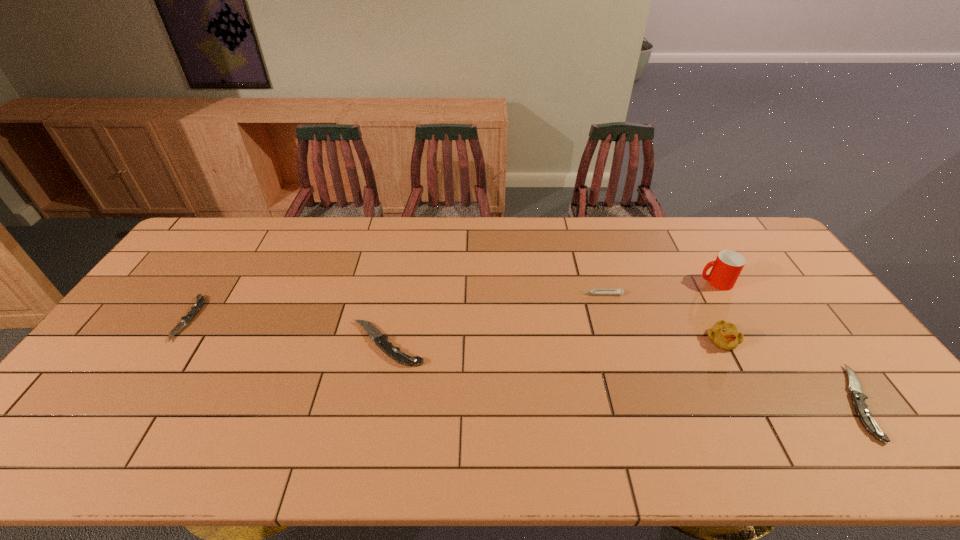
You are a GUI agent. You are given a task and a screenshot of the screen. Output one action in this format:
    pyautogui.click(x=<x>, y=<y>)
    Task: Click on the object at the left edge
    Image resolution: width=960 pixels, height=540 pixels.
    Given the screenshot: What is the action you would take?
    pyautogui.click(x=199, y=303)

Identify the location of object located at the right edge. (858, 398).

This screenshot has height=540, width=960. In order to click on object located at the near right corner in this screenshot , I will do `click(858, 398)`.

Locate an element on the screen. Image resolution: width=960 pixels, height=540 pixels. free space at the far edge is located at coordinates (382, 219).

In the image, there is a desktop. Identify the location of free space at the near edge. Image resolution: width=960 pixels, height=540 pixels. (270, 400).

The image size is (960, 540). I want to click on vacant space at the left edge of the desktop, so click(153, 301).

Where is `vacant area at the right edge`? This screenshot has height=540, width=960. vacant area at the right edge is located at coordinates (765, 259).

The image size is (960, 540). In order to click on free space between the leftmost pocketknife and the fifth object from right to left in this screenshot , I will do `click(288, 331)`.

Where is `free spot between the second pocketknife from left to right and the rightmost object`? free spot between the second pocketknife from left to right and the rightmost object is located at coordinates (623, 373).

The height and width of the screenshot is (540, 960). Find the location of `vacant space that is in between the second tallest pocketknife and the shortest object`. vacant space that is in between the second tallest pocketknife and the shortest object is located at coordinates (524, 360).